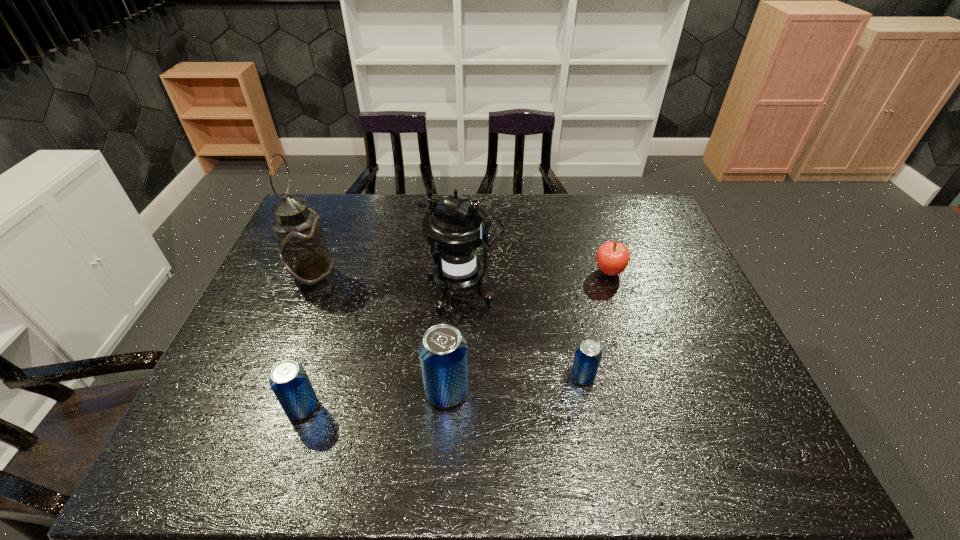
Given the evenly spaced beer cans in the image, where should an extra beer can be added on the right to preserve the spacing? Please point to a vacant space. Please provide its 2D coordinates. Your answer should be formatted as a tuple, i.e. [(x, y)], where the tuple contains the x and y coordinates of a point satisfying the conditions above.

[(711, 362)]